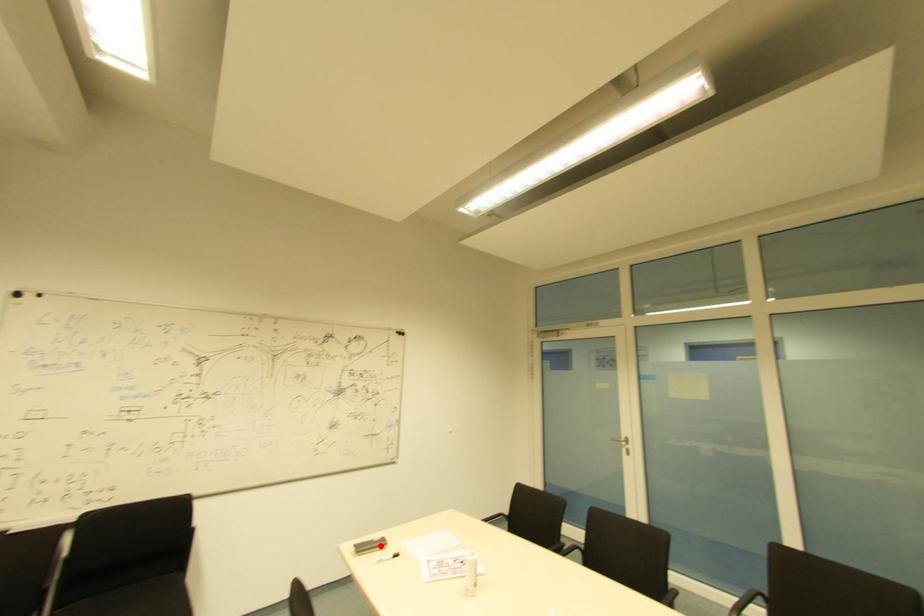
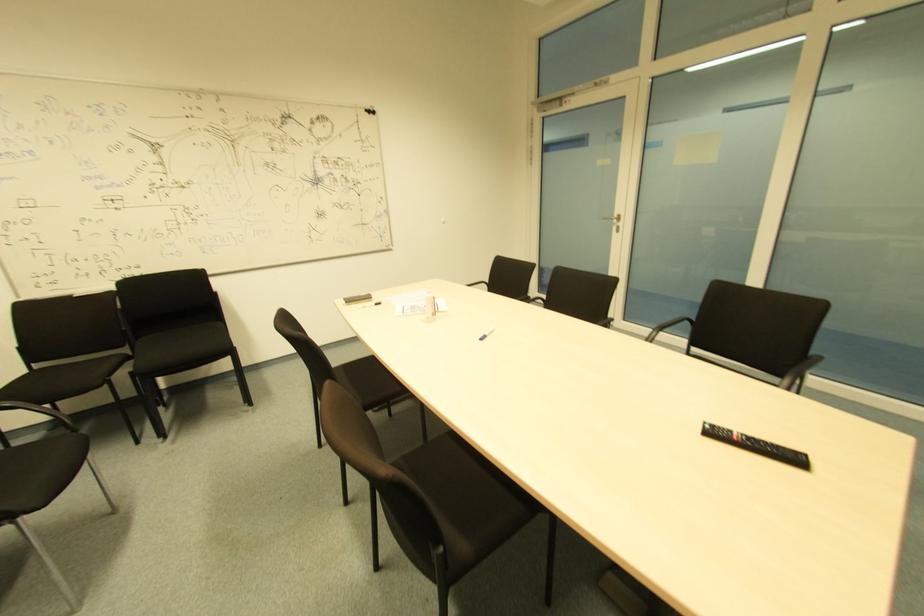
Find the pixel in the second image that matches the highlighted location in the first image.

(365, 301)